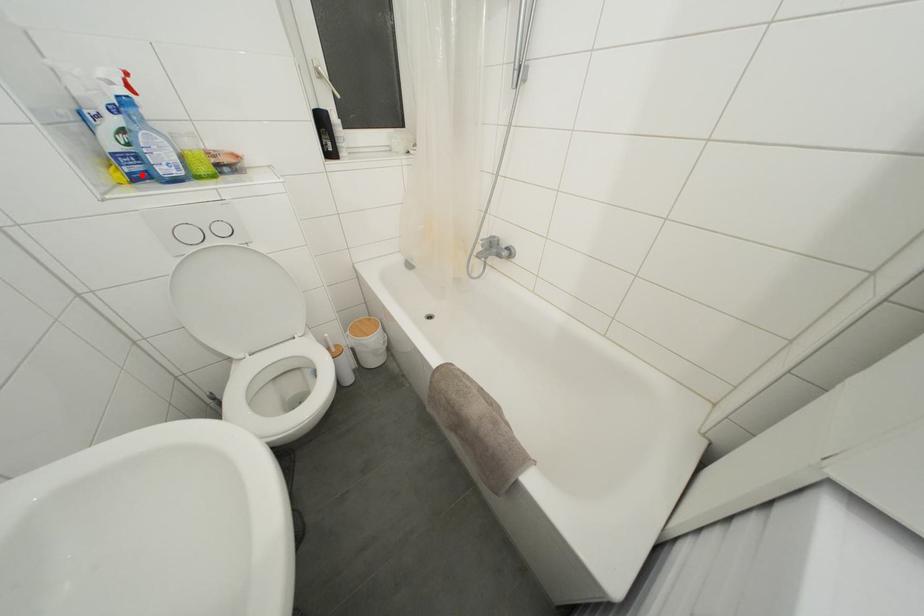
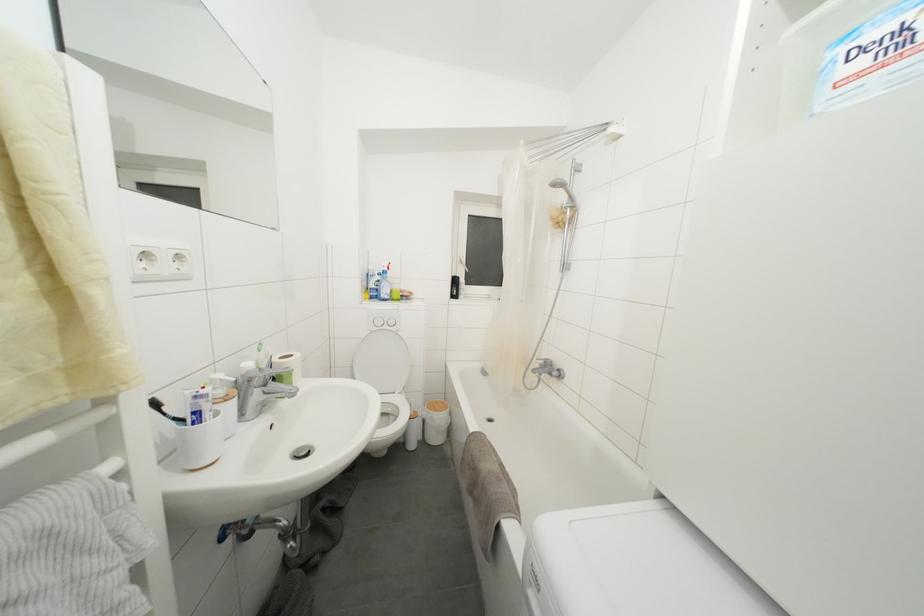
In the second image, find the point that corresponds to the highlighted location in the first image.

(379, 300)